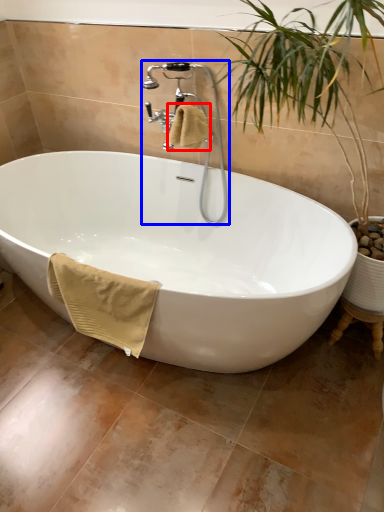
Question: Which object appears farthest to the camera in this image, bath towel (highlighted by a red box) or faucet (highlighted by a blue box)?

Choices:
 (A) bath towel
 (B) faucet

Answer: (A)